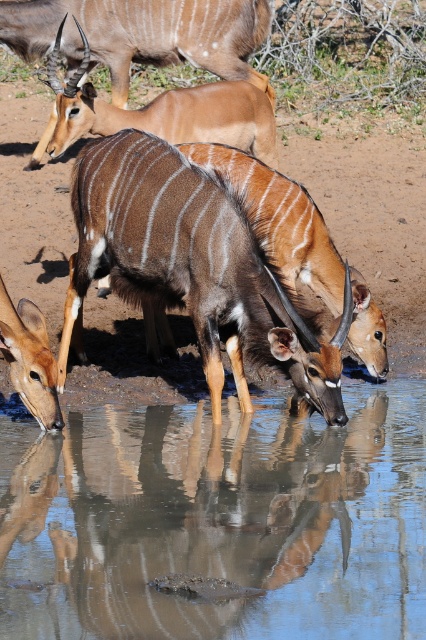
Which is behind, point (58, 515) or point (207, 225)?

Positioned behind is point (207, 225).

Does clear liquid water at center have a greater height compared to brown glossy antelope at center?

In fact, clear liquid water at center may be shorter than brown glossy antelope at center.

Is point (385, 625) positioned behind point (169, 292)?

No, (385, 625) is in front of (169, 292).

What are the coordinates of `clear liquid water at center` in the screenshot? It's located at (218, 522).

Between clear liquid water at center and brown glossy antelope at upper center, which one appears on the right side from the viewer's perspective?

From the viewer's perspective, clear liquid water at center appears more on the right side.

Is clear liquid water at center positioned in front of brown glossy antelope at upper center?

Yes, clear liquid water at center is closer to the viewer.

Describe the element at coordinates (218, 522) in the screenshot. Image resolution: width=426 pixels, height=640 pixels. I see `clear liquid water at center` at that location.

What are the coordinates of `clear liquid water at center` in the screenshot? It's located at (218, 522).

Describe the element at coordinates (146, 113) in the screenshot. I see `brown glossy antelope at upper center` at that location.

The height and width of the screenshot is (640, 426). What are the coordinates of `brown glossy antelope at upper center` in the screenshot? It's located at (146, 113).

Locate an element on the screen. Image resolution: width=426 pixels, height=640 pixels. brown glossy antelope at upper center is located at coordinates (146, 113).